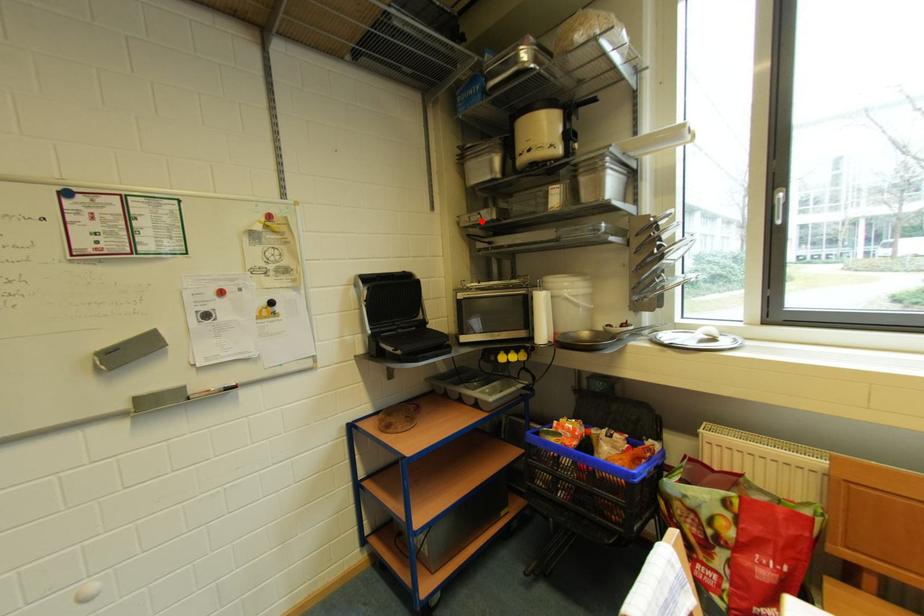
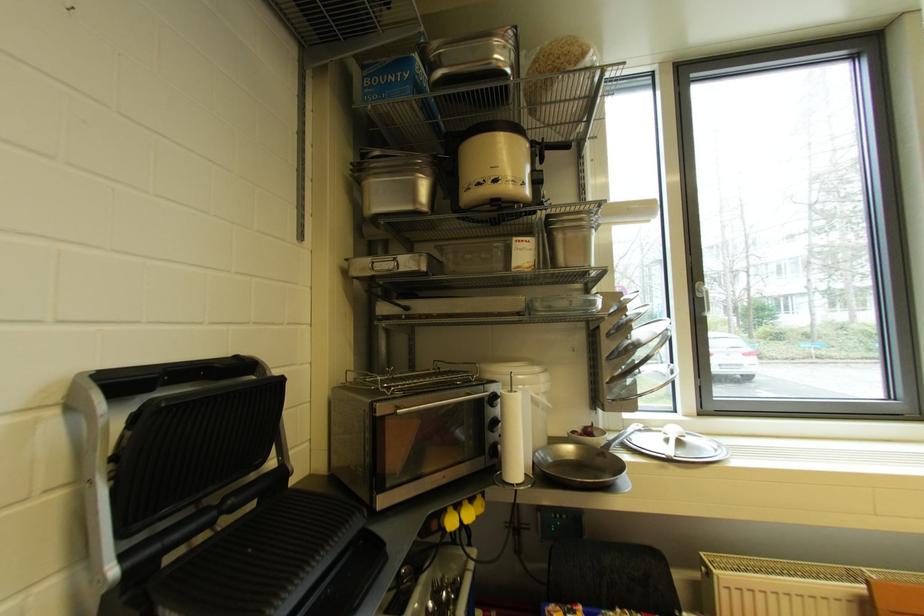
Find the pixel in the second image that matches the highlighted location in the first image.

(392, 269)